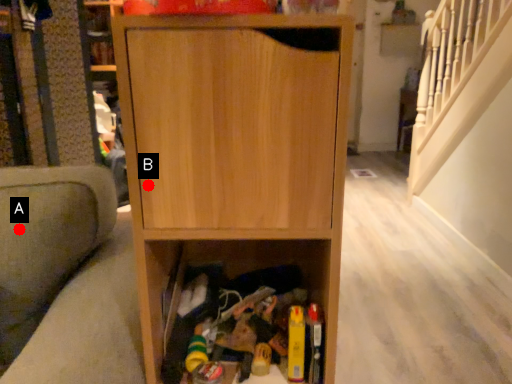
Question: Two points are circled on the image, labeled by A and B beside each circle. Which point is closer to the camera?

Choices:
 (A) A is closer
 (B) B is closer

Answer: (B)